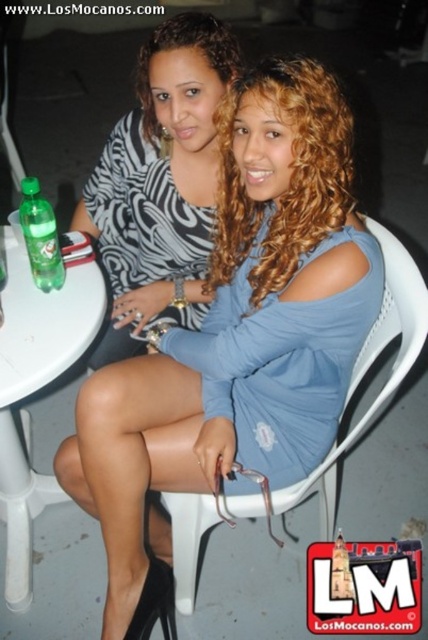
Question: Can you confirm if green plastic bottle at left is bigger than white plastic chair at center?

Choices:
 (A) no
 (B) yes

Answer: (A)

Question: Is blonde curly hair at center smaller than white plastic chair at center?

Choices:
 (A) yes
 (B) no

Answer: (A)

Question: Which object is closer to the camera taking this photo?

Choices:
 (A) zebra print dress at center
 (B) blue fabric dress at center
 (C) white plastic chair at center

Answer: (B)

Question: Is blue fabric dress at center wider than blonde curly hair at center?

Choices:
 (A) no
 (B) yes

Answer: (B)

Question: Among these points, which one is nearest to the camera?

Choices:
 (A) (36, 253)
 (B) (216, 49)
 (C) (187, 305)

Answer: (A)

Question: Which object appears farthest from the camera in this image?

Choices:
 (A) white plastic chair at center
 (B) green matte plastic bottle at left

Answer: (B)